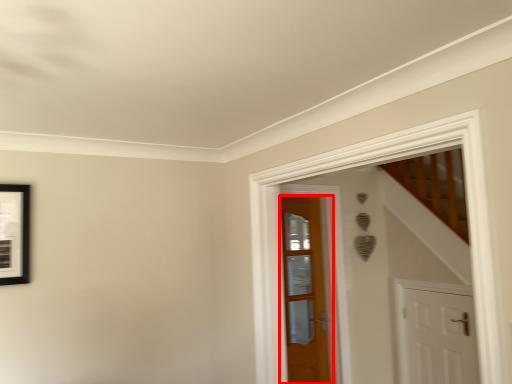
Question: From the image's perspective, considering the relative positions of door (annotated by the red box) and door in the image provided, where is door (annotated by the red box) located with respect to the staircase?

Choices:
 (A) above
 (B) below

Answer: (A)